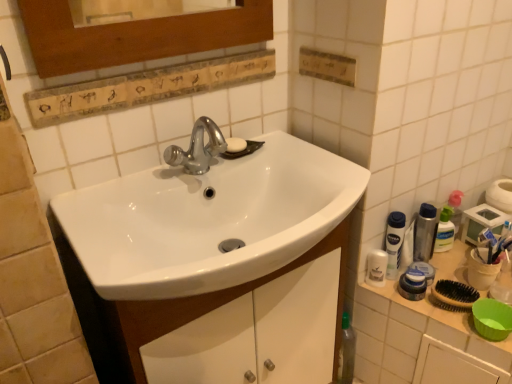
Question: Is translucent plastic mouthwash at right, acting as the first mouthwash starting from the right, at the right side of white plastic bottle at right, the 4th mouthwash viewed from the right?

Choices:
 (A) yes
 (B) no

Answer: (A)

Question: Does translucent plastic mouthwash at right, acting as the first mouthwash starting from the right, have a greater width compared to white plastic bottle at right, which is the 2th mouthwash from left to right?

Choices:
 (A) yes
 (B) no

Answer: (B)

Question: Can you confirm if translucent plastic mouthwash at right, acting as the first mouthwash starting from the right, is shorter than white plastic bottle at right, the 4th mouthwash viewed from the right?

Choices:
 (A) no
 (B) yes

Answer: (B)

Question: From a real-world perspective, is translucent plastic mouthwash at right, acting as the first mouthwash starting from the right, under white plastic bottle at right, the 4th mouthwash viewed from the right?

Choices:
 (A) no
 (B) yes

Answer: (B)

Question: Is translucent plastic mouthwash at right, acting as the first mouthwash starting from the right, looking in the opposite direction of white plastic bottle at right, the 4th mouthwash viewed from the right?

Choices:
 (A) yes
 (B) no

Answer: (B)

Question: Considering the relative sizes of translucent plastic mouthwash at right, acting as the first mouthwash starting from the right, and white plastic bottle at right, the 4th mouthwash viewed from the right, in the image provided, is translucent plastic mouthwash at right, acting as the first mouthwash starting from the right, taller than white plastic bottle at right, the 4th mouthwash viewed from the right,?

Choices:
 (A) yes
 (B) no

Answer: (B)

Question: From a real-world perspective, is white glossy sink at center positioned under white plastic container at right based on gravity?

Choices:
 (A) no
 (B) yes

Answer: (A)

Question: Is white glossy sink at center oriented away from white plastic container at right?

Choices:
 (A) yes
 (B) no

Answer: (B)

Question: Is white glossy sink at center not close to white plastic container at right?

Choices:
 (A) yes
 (B) no

Answer: (B)

Question: Is white glossy sink at center positioned behind white plastic container at right?

Choices:
 (A) no
 (B) yes

Answer: (A)

Question: Does white glossy sink at center have a larger size compared to white plastic container at right?

Choices:
 (A) no
 (B) yes

Answer: (A)

Question: Is white plastic container at right completely or partially inside white glossy sink at center?

Choices:
 (A) no
 (B) yes

Answer: (A)

Question: Is white plastic bottle at right, which is the 2th mouthwash from left to right, facing away from white plastic container at right?

Choices:
 (A) yes
 (B) no

Answer: (B)